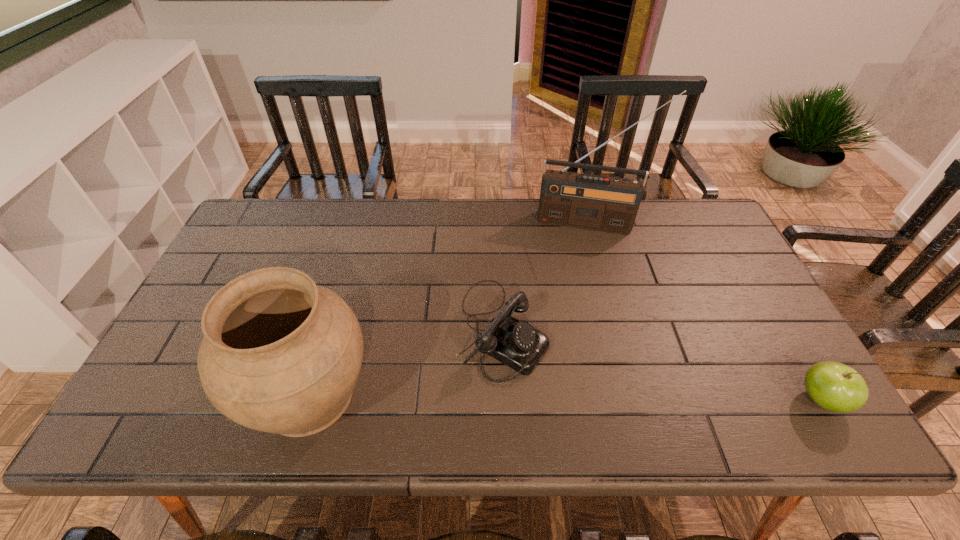
This screenshot has height=540, width=960. Identify the location of free location located 0.070m on the front-facing side of the telephone. (568, 373).

Where is `vacant space positioned on the front-facing side of the radio receiver`? vacant space positioned on the front-facing side of the radio receiver is located at coordinates [576, 292].

The height and width of the screenshot is (540, 960). I want to click on free location located on the front-facing side of the radio receiver, so click(576, 292).

This screenshot has width=960, height=540. What are the coordinates of `vacant area situated 0.360m on the front-facing side of the radio receiver` in the screenshot? It's located at (573, 322).

Where is `object present at the far edge`? object present at the far edge is located at coordinates (607, 204).

Locate an element on the screen. This screenshot has width=960, height=540. urn present at the near edge is located at coordinates (280, 354).

The image size is (960, 540). In order to click on apple located at the near edge in this screenshot , I will do point(834,386).

Find the location of `telephone that is at the near edge`. telephone that is at the near edge is located at coordinates (517, 344).

Identify the location of object that is at the right edge. This screenshot has width=960, height=540. (834, 386).

This screenshot has width=960, height=540. I want to click on object that is at the near right corner, so click(834, 386).